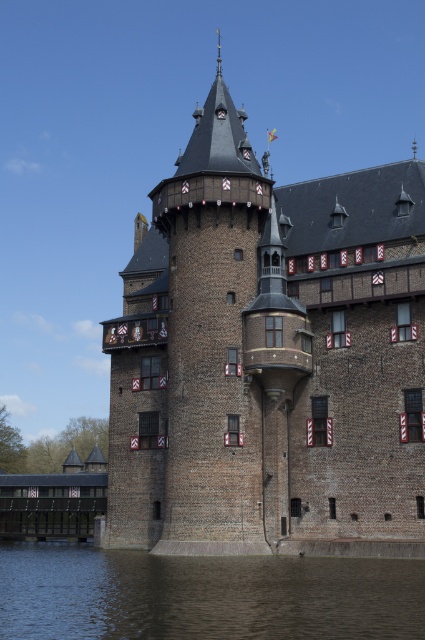
You are a drone operator who needs to capture aerial footage of the brown brick castle at center. Your drone has a maximum flight range of 150 feet. Based on the scene, can your drone safely reach the castle from your current position?

The distance between the brown brick castle at center and the camera is 157.86 feet, which exceeds the drone operator drone maximum flight range of 150 feet. Therefore, the drone cannot safely reach the castle from the current position.

You are standing in front of the castle and see two points marked on the castle walls. Which point is closer to you, point (340, 182) or point (340, 628)?

Point (340, 182) is further to the viewer than point (340, 628), so point (340, 628) is closer to you.